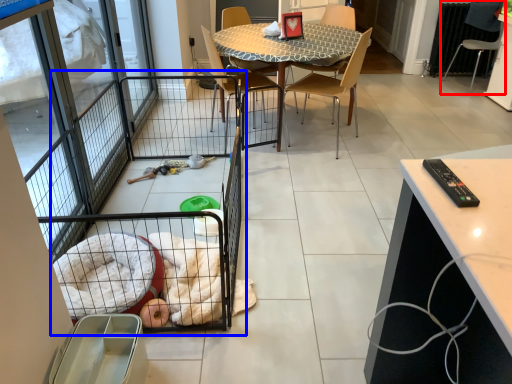
Question: Which object is further to the camera taking this photo, chair (highlighted by a red box) or balcony (highlighted by a blue box)?

Choices:
 (A) chair
 (B) balcony

Answer: (A)